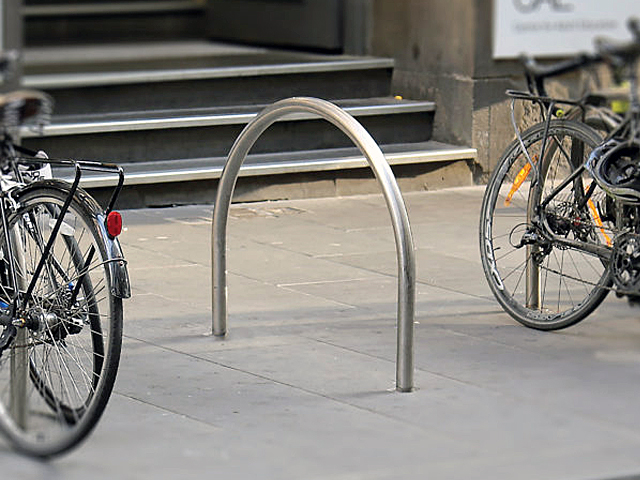
Image resolution: width=640 pixels, height=480 pixels. What are the coordinates of `stone floor` in the screenshot? It's located at (336, 235).